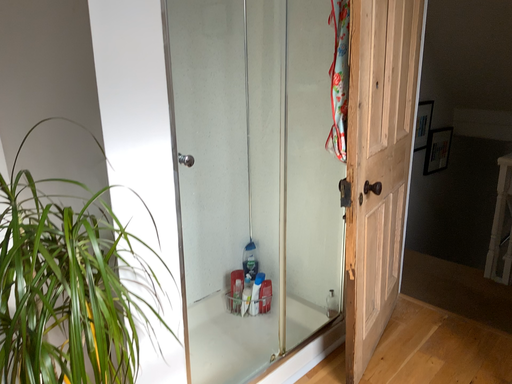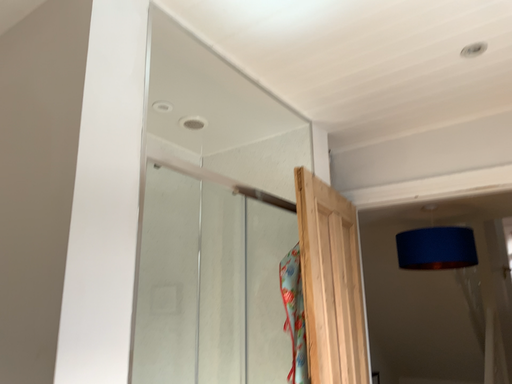
Question: Which way did the camera rotate in the video?

Choices:
 (A) rotated right
 (B) rotated left

Answer: (A)